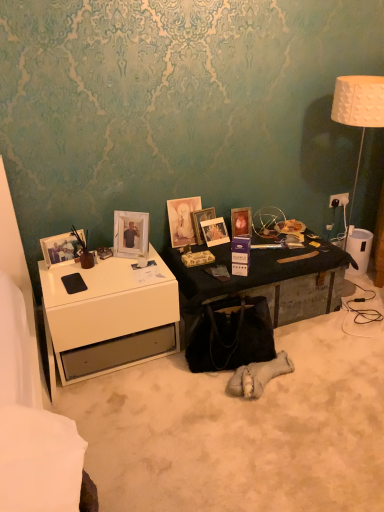
You are a GUI agent. You are given a task and a screenshot of the screen. Output one action in this format:
    pyautogui.click(x=<x>, y=<y>)
    Task: Click on the free space above white glossy desk at left (from a real-world perspective)
    The height and width of the screenshot is (512, 384).
    Given the screenshot: What is the action you would take?
    pyautogui.click(x=90, y=267)